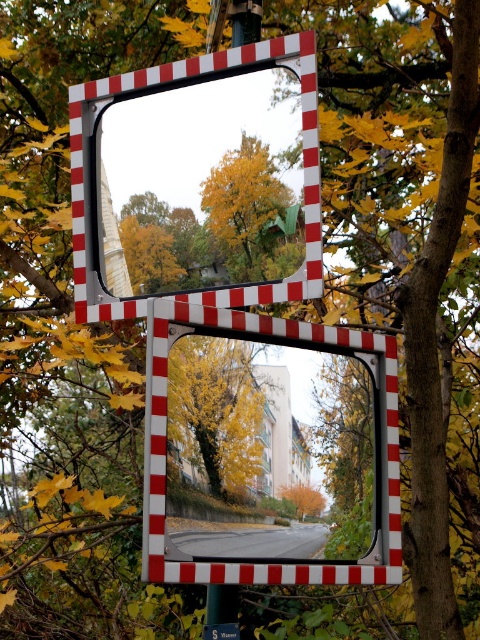
In order to click on reflective glass mirror at center in this screenshot , I will do `click(166, 440)`.

Is reflective glass mirror at center shorter than green plastic sign at lower center?

Incorrect, reflective glass mirror at center's height does not fall short of green plastic sign at lower center's.

You are a GUI agent. You are given a task and a screenshot of the screen. Output one action in this format:
    pyautogui.click(x=<x>, y=<y>)
    Task: Click on the reflective glass mirror at center
    Image resolution: width=480 pixels, height=640 pixels.
    Given the screenshot: What is the action you would take?
    pyautogui.click(x=166, y=440)